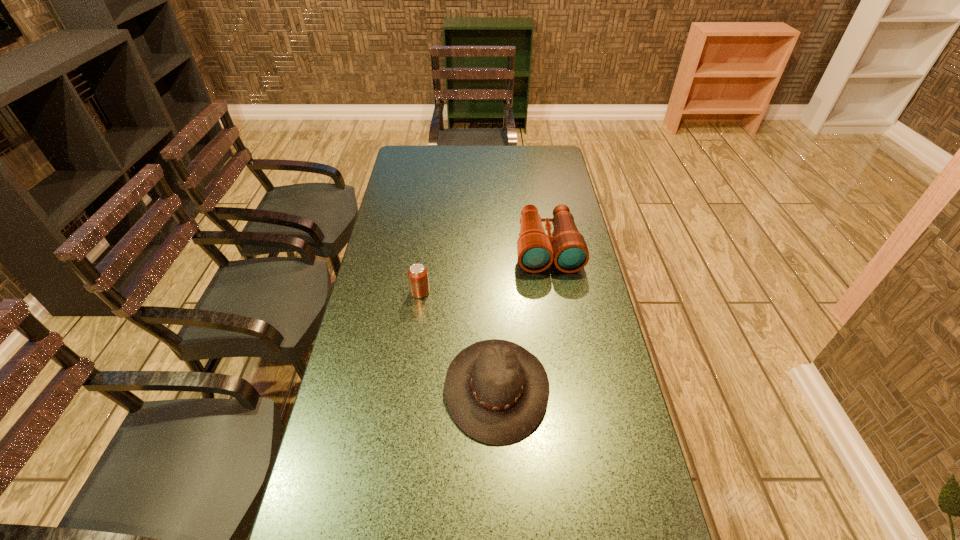
Identify the location of binoculars. (536, 250).

The width and height of the screenshot is (960, 540). I want to click on the nearest object, so click(497, 392).

The width and height of the screenshot is (960, 540). Identify the location of the second farthest object. (418, 279).

Locate an element on the screen. The height and width of the screenshot is (540, 960). the leftmost object is located at coordinates (418, 279).

You are a GUI agent. You are given a task and a screenshot of the screen. Output one action in this format:
    pyautogui.click(x=<x>, y=<y>)
    Task: Click on the free region located through the lenses of the binoculars
    This screenshot has width=960, height=540.
    Given the screenshot: What is the action you would take?
    pyautogui.click(x=561, y=326)

This screenshot has width=960, height=540. What are the coordinates of `free spot located on the front-facing side of the hat` in the screenshot? It's located at (404, 388).

Find the location of `free space located 0.110m on the front-facing side of the hat`. free space located 0.110m on the front-facing side of the hat is located at coordinates tap(404, 388).

The width and height of the screenshot is (960, 540). What are the coordinates of `vacant area situated 0.200m on the front-facing side of the hat` in the screenshot? It's located at (371, 388).

You are a GUI agent. You are given a task and a screenshot of the screen. Output one action in this format:
    pyautogui.click(x=<x>, y=<y>)
    Task: Click on the free region located on the right of the second nearest object
    This screenshot has width=960, height=540.
    Given the screenshot: What is the action you would take?
    pyautogui.click(x=489, y=292)

The image size is (960, 540). In order to click on object that is positioned at the left edge in this screenshot , I will do `click(418, 279)`.